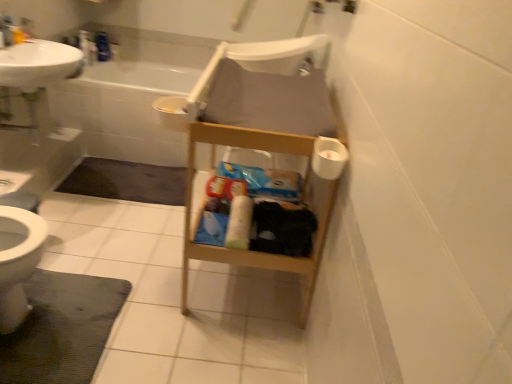
Question: Which direction should I rotate to face white matte toilet paper at center, the second toilet paper positioned from the top, — up or down?

Choices:
 (A) down
 (B) up

Answer: (A)

Question: Should I look upward or downward to see dark gray carpet at lower left, arranged as the 1th bath mat when viewed from the top?

Choices:
 (A) down
 (B) up

Answer: (B)

Question: Does white glossy sink at upper left appear on the left side of dark gray carpet at lower left, placed as the 2th bath mat when sorted from front to back?

Choices:
 (A) no
 (B) yes

Answer: (B)

Question: Is white glossy sink at upper left behind dark gray carpet at lower left, the 2th bath mat positioned from the bottom?

Choices:
 (A) yes
 (B) no

Answer: (B)

Question: Is white glossy sink at upper left facing towards dark gray carpet at lower left, arranged as the 1th bath mat when viewed from the top?

Choices:
 (A) yes
 (B) no

Answer: (B)

Question: From the image's perspective, is white glossy sink at upper left under dark gray carpet at lower left, placed as the 2th bath mat when sorted from front to back?

Choices:
 (A) no
 (B) yes

Answer: (A)

Question: From a real-world perspective, is white glossy sink at upper left physically below dark gray carpet at lower left, the 2th bath mat positioned from the bottom?

Choices:
 (A) no
 (B) yes

Answer: (A)

Question: Is white glossy sink at upper left facing away from dark gray carpet at lower left, arranged as the 1th bath mat when viewed from the top?

Choices:
 (A) no
 (B) yes

Answer: (A)

Question: Is white matte toilet paper at right, the 2th toilet paper positioned from the bottom, to the left of white glossy sink at upper left from the viewer's perspective?

Choices:
 (A) yes
 (B) no

Answer: (B)

Question: From a real-world perspective, is white matte toilet paper at right, the 2th toilet paper positioned from the bottom, beneath white glossy sink at upper left?

Choices:
 (A) no
 (B) yes

Answer: (A)

Question: Is white matte toilet paper at right, which ranks as the second toilet paper in back-to-front order, surrounding white glossy sink at upper left?

Choices:
 (A) yes
 (B) no

Answer: (B)

Question: From the image's perspective, is white matte toilet paper at right, arranged as the first toilet paper when viewed from the right, above white glossy sink at upper left?

Choices:
 (A) yes
 (B) no

Answer: (B)

Question: Is white matte toilet paper at right, the 1th toilet paper viewed from the top, shorter than white glossy sink at upper left?

Choices:
 (A) no
 (B) yes

Answer: (B)

Question: From the image's perspective, is white matte toilet paper at right, the 1th toilet paper when ordered from front to back, under white glossy sink at upper left?

Choices:
 (A) no
 (B) yes

Answer: (B)

Question: Can you see white plastic chair at center touching dark gray textured bath mat at lower left, the 1th bath mat when ordered from front to back?

Choices:
 (A) yes
 (B) no

Answer: (B)